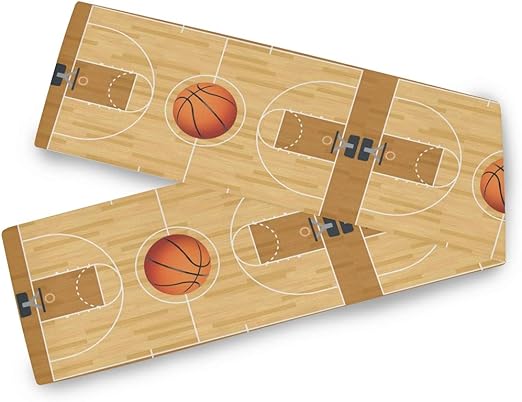
Locate an element on the screen. table runner is located at coordinates (309, 183).